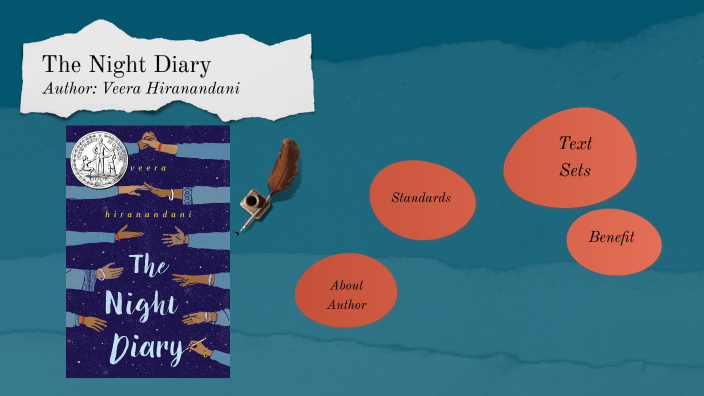
Image resolution: width=704 pixels, height=396 pixels. Find the location of `book`. book is located at coordinates tap(155, 221).